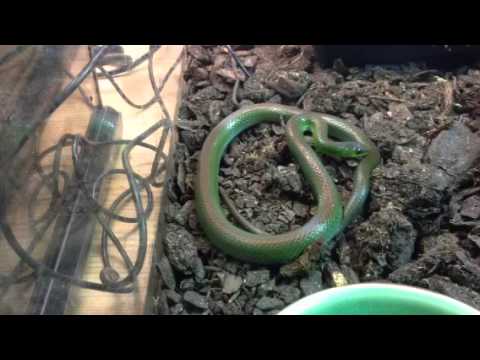
You are a GUI agent. You are given a task and a screenshot of the screen. Output one action in this format:
    pyautogui.click(x=<x>, y=<y>)
    Task: Click on the beige wooden floor
    This screenshot has height=360, width=480.
    Given the screenshot: What is the action you would take?
    pyautogui.click(x=141, y=115)